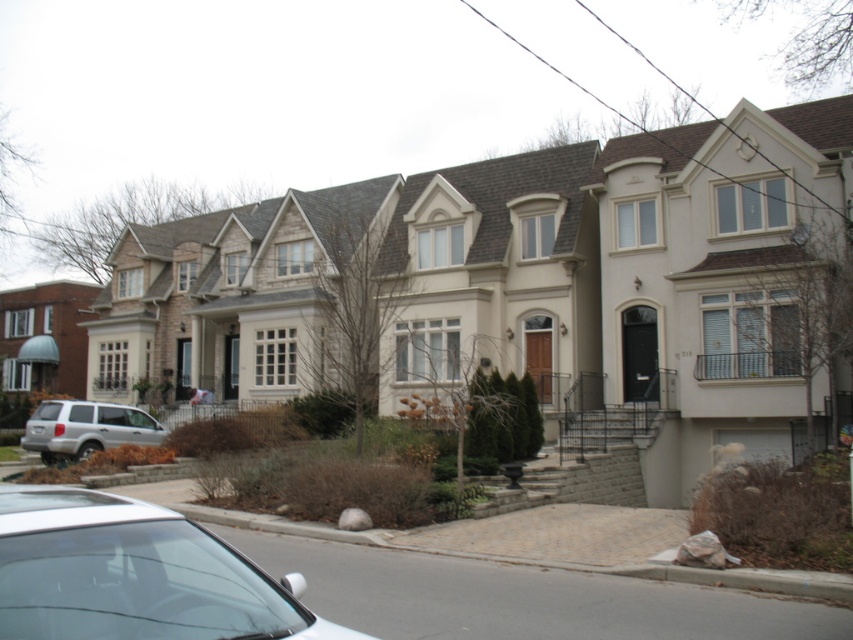
Between point (54, 512) and point (74, 422), which one is positioned behind?

The point (74, 422) is behind.

Between white glossy car at lower left and silver metallic suv at lower left, which one has less height?

Standing shorter between the two is white glossy car at lower left.

The height and width of the screenshot is (640, 853). What do you see at coordinates (134, 573) in the screenshot?
I see `white glossy car at lower left` at bounding box center [134, 573].

At what (x,y) coordinates should I click in order to perform the action: click on white glossy car at lower left. Please return your answer as a coordinate pair (x, y). Image resolution: width=853 pixels, height=640 pixels. Looking at the image, I should click on (134, 573).

Based on the photo, which is more to the left, white glossy car at lower left or gray concrete curb at lower center?

white glossy car at lower left is more to the left.

Is point (78, 586) farther from viewer compared to point (851, 593)?

That is False.

This screenshot has height=640, width=853. In order to click on white glossy car at lower left in this screenshot , I will do tap(134, 573).

Who is more forward, (811, 573) or (45, 400)?

Point (811, 573) is more forward.

Is gray concrete curb at lower center smaller than silver metallic suv at lower left?

Yes.

Which is behind, point (412, 541) or point (76, 420)?

Positioned behind is point (76, 420).

Where is `gray concrete curb at lower center`? gray concrete curb at lower center is located at coordinates (556, 545).